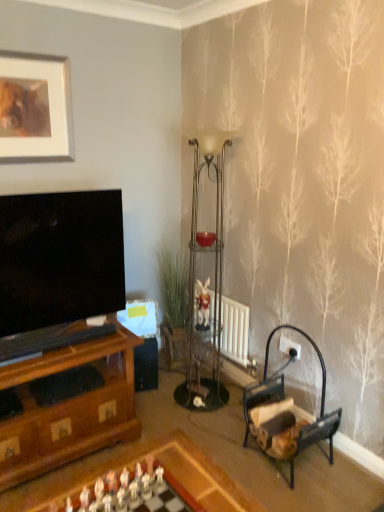
The height and width of the screenshot is (512, 384). I want to click on vacant space in front of metallic glass side table at center, so click(x=187, y=411).